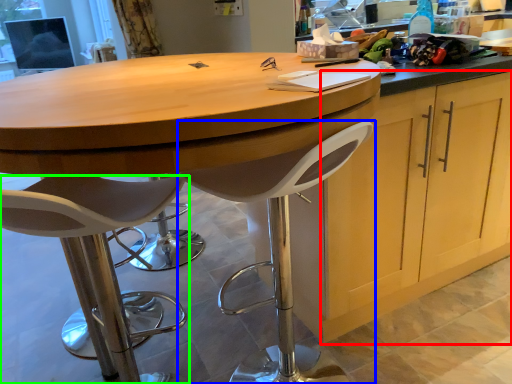
Question: Based on their relative distances, which object is nearer to cabinetry (highlighted by a red box)? Choose from chair (highlighted by a blue box) and chair (highlighted by a green box).

Choices:
 (A) chair
 (B) chair

Answer: (A)